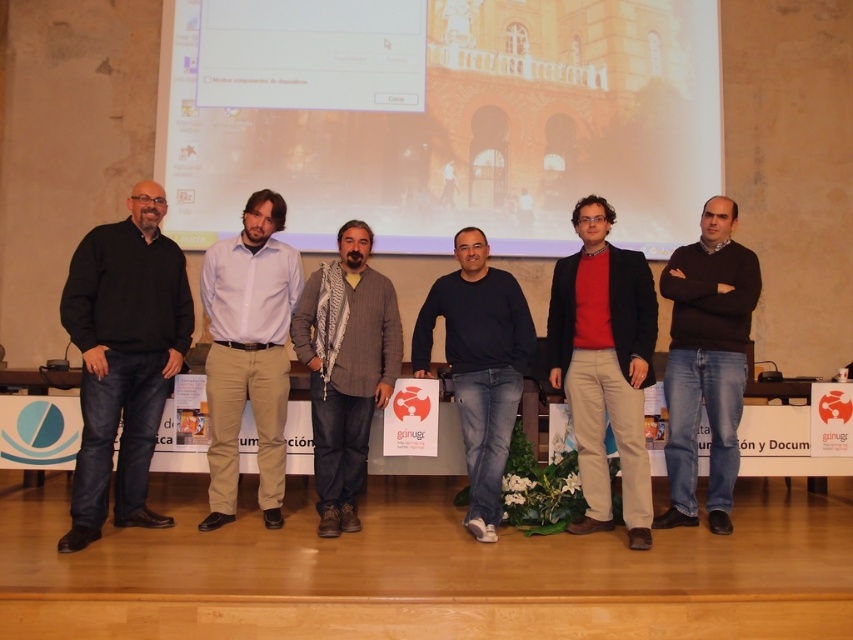
Question: Can you confirm if red matte sweater at center is positioned to the left of brown sweater at center?

Choices:
 (A) no
 (B) yes

Answer: (B)

Question: Which point appears closest to the camera in this image?

Choices:
 (A) (634, 216)
 (B) (123, 241)
 (C) (582, 428)

Answer: (B)

Question: Can you confirm if black matte sweater at left is positioned to the left of gray wool scarf at center?

Choices:
 (A) no
 (B) yes

Answer: (B)

Question: Which point is farther from the camera taking this photo?

Choices:
 (A) (354, 305)
 (B) (479, 328)

Answer: (B)

Question: Does brown sweater at center appear over dark blue sweater at center?

Choices:
 (A) no
 (B) yes

Answer: (B)

Question: Which object is farther from the camera taking this photo?

Choices:
 (A) gray wool scarf at center
 (B) black matte sweater at left
 (C) brown sweater at center

Answer: (C)